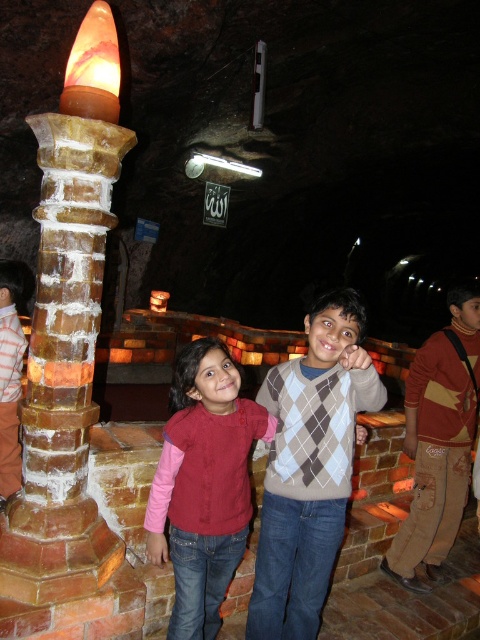
Question: In this image, where is sandy stone pillar at left located relative to argyle sweater at center?

Choices:
 (A) above
 (B) below

Answer: (A)

Question: Does sandy stone pillar at left have a smaller size compared to velvet pink sweater at center?

Choices:
 (A) no
 (B) yes

Answer: (A)

Question: Which point is closer to the camera taking this photo?

Choices:
 (A) (244, 502)
 (B) (16, 458)

Answer: (A)

Question: Does brown cotton pants at lower right appear on the right side of matte brick column at left?

Choices:
 (A) no
 (B) yes

Answer: (B)

Question: Among these objects, which one is farthest from the camera?

Choices:
 (A) brown cotton pants at lower right
 (B) sandy stone pillar at left

Answer: (A)

Question: Which point is closer to the camera?

Choices:
 (A) sandy stone pillar at left
 (B) matte brick column at left
 (C) brown cotton pants at lower right

Answer: (A)